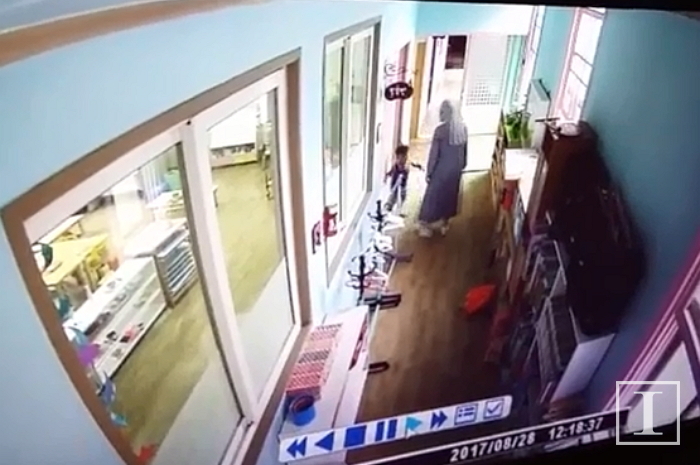
This screenshot has width=700, height=465. I want to click on blue bowl, so click(x=302, y=408).